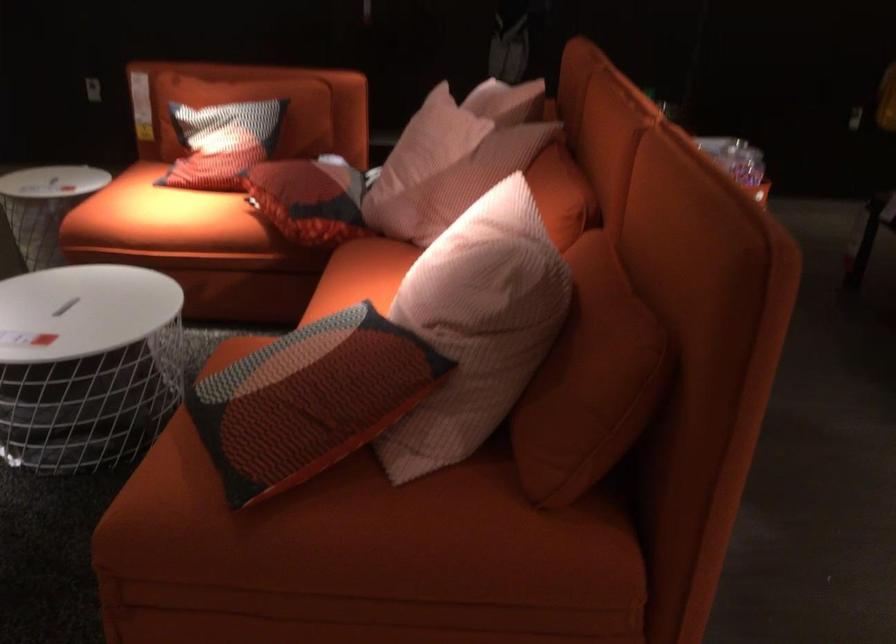
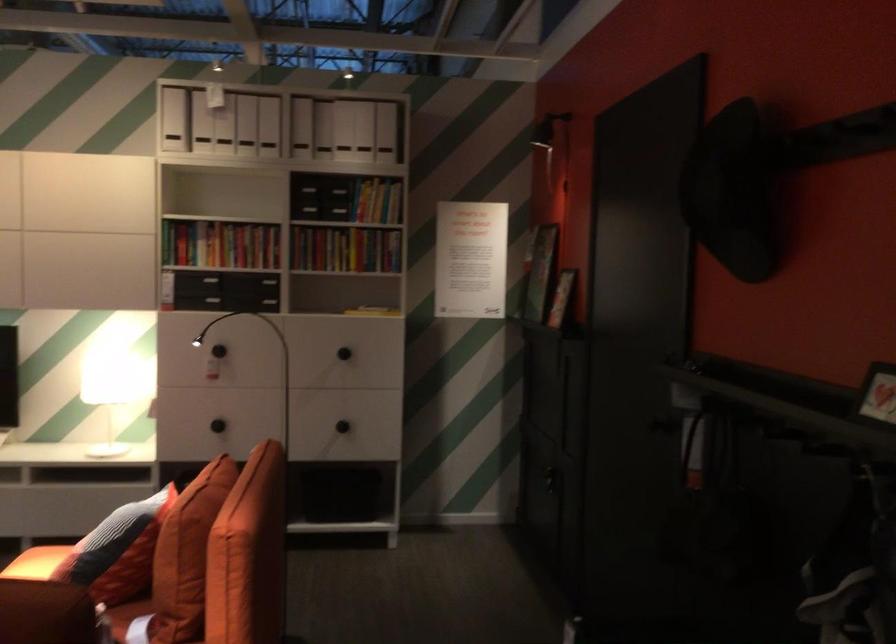
Where in the second image is the point corresponding to pixel 154 192 from the first image?

(36, 563)